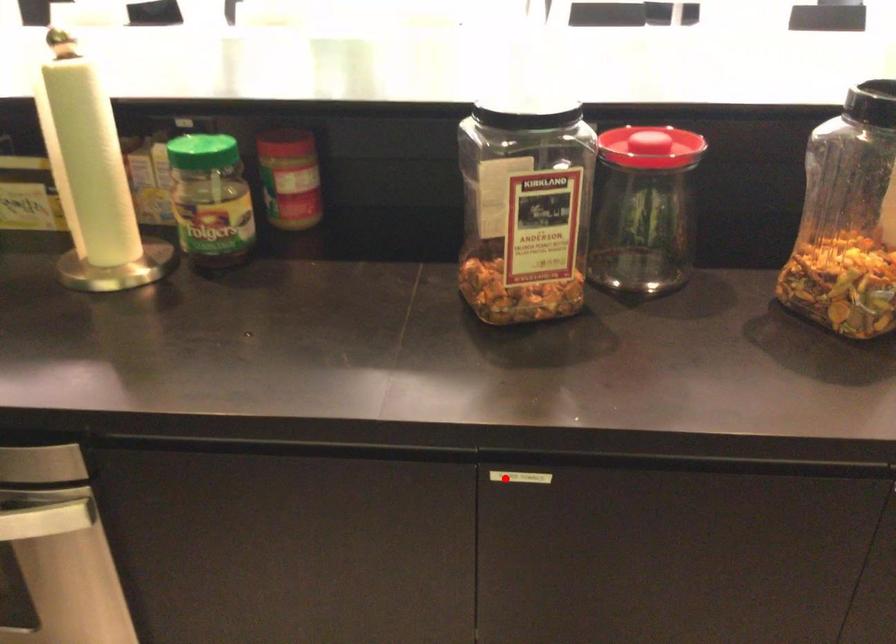
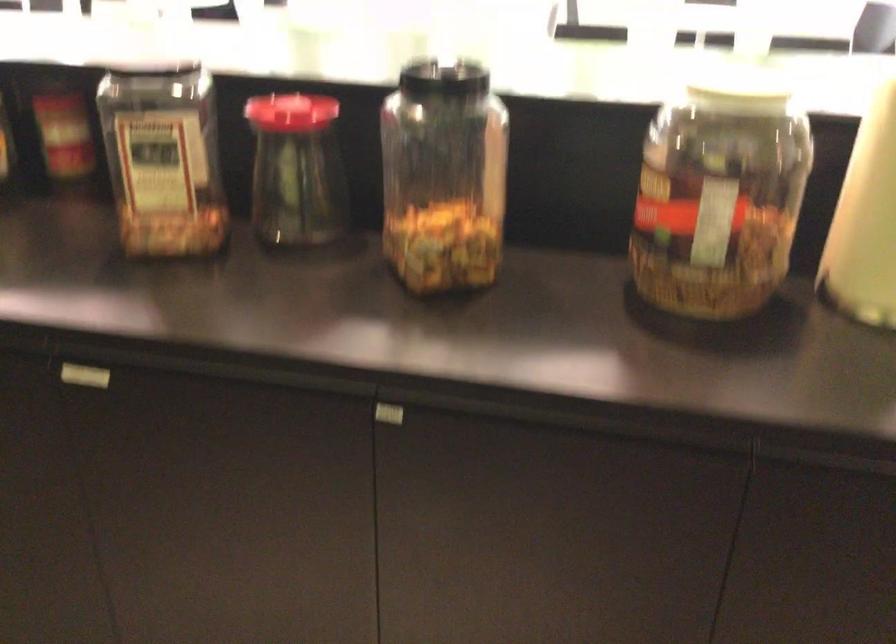
Question: A red point is marked in image1. In image2, is the corresponding 3D point closer to the camera or farther? Reply with the corresponding letter.

Choices:
 (A) The corresponding 3D point is closer.
 (B) The corresponding 3D point is farther.

Answer: (B)